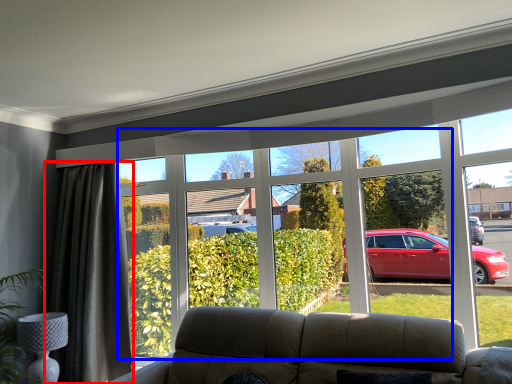
Question: Which object is closer to the camera taking this photo, curtain (highlighted by a red box) or bay window (highlighted by a blue box)?

Choices:
 (A) curtain
 (B) bay window

Answer: (B)